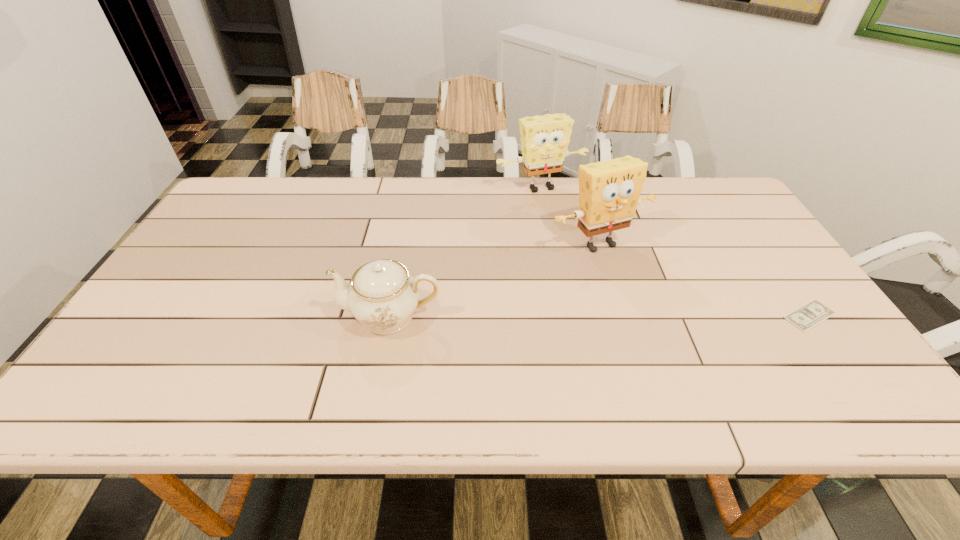
I want to click on free space that is in between the farther sponge and the leftmost object, so click(466, 251).

Where is `free space that is in between the leftmost object and the money`? Image resolution: width=960 pixels, height=540 pixels. free space that is in between the leftmost object and the money is located at coordinates (600, 315).

The image size is (960, 540). Find the location of `free space between the farther sponge and the chinaware`. free space between the farther sponge and the chinaware is located at coordinates (466, 251).

What are the coordinates of `empty space between the nearer sponge and the money` in the screenshot? It's located at (704, 279).

Locate which object ranks second in proximity to the nearer sponge. Please provide its 2D coordinates. Your answer should be formatted as a tuple, i.e. [(x, y)], where the tuple contains the x and y coordinates of a point satisfying the conditions above.

[(807, 316)]

Find the location of a particular element. the third closest object relative to the rightmost object is located at coordinates (383, 295).

Where is `free location that satisfies the following two spatial constraints: 1. on the front side of the money; 2. on the right side of the nearer sponge`? This screenshot has height=540, width=960. free location that satisfies the following two spatial constraints: 1. on the front side of the money; 2. on the right side of the nearer sponge is located at coordinates (620, 315).